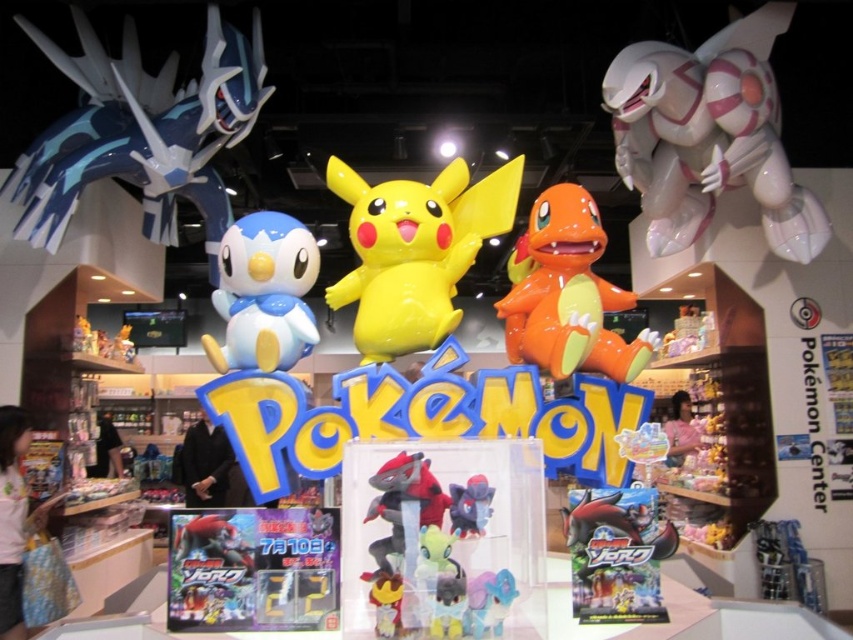
You are a customer at the store and want to place a small gift card between the shiny orange plastic charmander at center and the matte gray plush at center. The gift card is 10 centimeters long. Is there enough space to place it between them?

The shiny orange plastic charmander at center is 85.42 centimeters from matte gray plush at center. Since the gift card is only 10 centimeters long, there is ample space to place it between them.

You are a customer at the Pokemon Center and want to place both the glossy plastic penguin at upper left and the shiny orange plastic charmander at center on your shelf at home. If your shelf has limited vertical space, which of the two statues should you choose to fit within the height constraint?

The shiny orange plastic charmander at center is shorter than the glossy plastic penguin at upper left, so it would be the better choice to fit within the height constraint.

You are standing in front of the display at the Pokemon Center. You notice two points marked on the floor at coordinates point (225, 296) and point (415, 484). If you want to place a new statue closer to the viewer, which point should you choose?

You should choose point (225, 296) because it is further to the viewer than point (415, 484), making it a better location for placing the statue closer to the viewer.